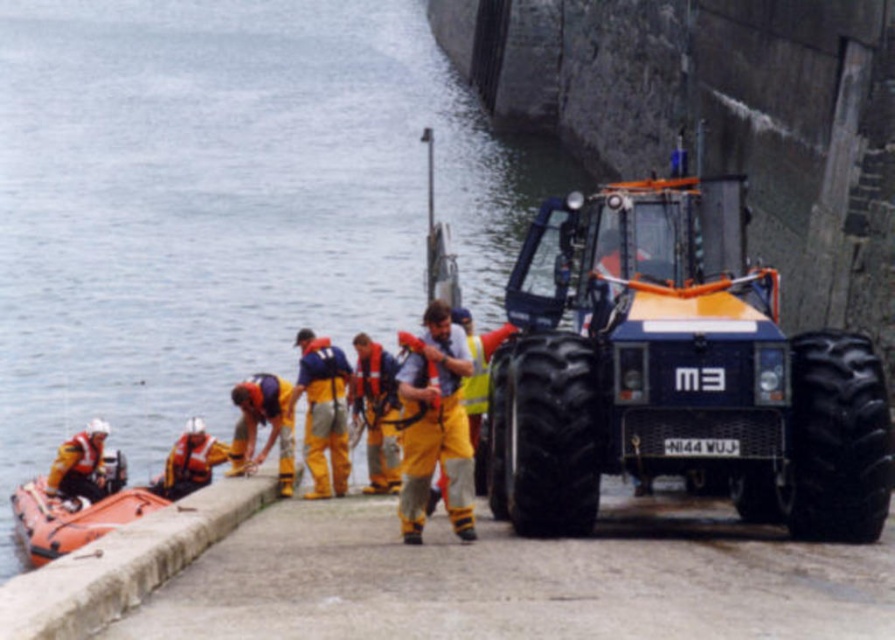
Question: Does orange rubber boat at lower left have a lesser width compared to yellow reflective pants at center?

Choices:
 (A) no
 (B) yes

Answer: (A)

Question: Does yellow waterproof suit at center have a larger size compared to yellow fabric pants at center?

Choices:
 (A) no
 (B) yes

Answer: (A)

Question: Which point appears farthest from the camera in this image?

Choices:
 (A) (330, 492)
 (B) (56, 474)
 (C) (274, 173)

Answer: (C)

Question: Which point appears farthest from the camera in this image?

Choices:
 (A) (356, 417)
 (B) (132, 99)
 (C) (716, 326)
 (D) (179, 445)

Answer: (B)

Question: Can you confirm if orange rubber boat at lower left is positioned below orange reflective jacket at center?

Choices:
 (A) yes
 (B) no

Answer: (A)

Question: Estimate the real-world distances between objects in this image. Which object is closer to the orange metallic tractor at center?

Choices:
 (A) smooth water at lower left
 (B) orange rubber boat at lower left
 (C) orange reflective jacket at center

Answer: (C)